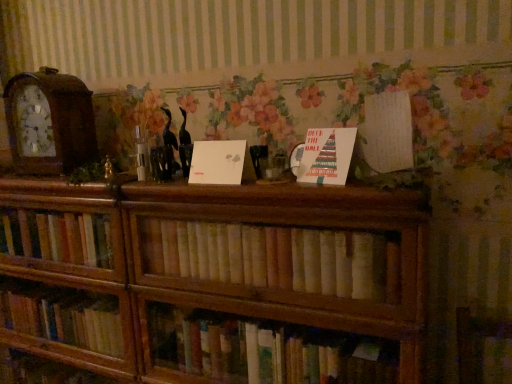
Question: Does light brown wooden bookshelf at center have a smaller size compared to white paper at upper right, the 1th paperback book when ordered from right to left?

Choices:
 (A) yes
 (B) no

Answer: (B)

Question: Is light brown wooden bookshelf at center at the left side of white paper at upper right, the third paperback book from the left?

Choices:
 (A) yes
 (B) no

Answer: (A)

Question: Is light brown wooden bookshelf at center oriented towards white paper at upper right, the third paperback book from the left?

Choices:
 (A) no
 (B) yes

Answer: (A)

Question: Does light brown wooden bookshelf at center have a larger size compared to white paper at upper right, the 1th paperback book when ordered from right to left?

Choices:
 (A) yes
 (B) no

Answer: (A)

Question: Is white paper at upper right, the 1th paperback book when ordered from right to left, inside light brown wooden bookshelf at center?

Choices:
 (A) no
 (B) yes

Answer: (A)

Question: Can you confirm if light brown wooden bookshelf at center is taller than white paper at upper right, the 1th paperback book when ordered from right to left?

Choices:
 (A) yes
 (B) no

Answer: (B)

Question: Is white paper at center, positioned as the first paperback book in left-to-right order, aimed at wooden clock at left?

Choices:
 (A) yes
 (B) no

Answer: (B)

Question: Is white paper at center, positioned as the first paperback book in left-to-right order, further to the viewer compared to wooden clock at left?

Choices:
 (A) yes
 (B) no

Answer: (B)

Question: Considering the relative sizes of white paper at center, positioned as the first paperback book in left-to-right order, and wooden clock at left in the image provided, is white paper at center, positioned as the first paperback book in left-to-right order, shorter than wooden clock at left?

Choices:
 (A) no
 (B) yes

Answer: (B)

Question: Can you confirm if white paper at center, positioned as the first paperback book in left-to-right order, is positioned to the left of wooden clock at left?

Choices:
 (A) yes
 (B) no

Answer: (B)

Question: Is white paper at center, the third paperback book when ordered from right to left, not close to wooden clock at left?

Choices:
 (A) no
 (B) yes

Answer: (A)

Question: Can you confirm if white paper at center, the third paperback book when ordered from right to left, is wider than wooden clock at left?

Choices:
 (A) no
 (B) yes

Answer: (A)

Question: Does white paper at center, which ranks as the 2th paperback book in left-to-right order, have a lesser width compared to wooden clock at left?

Choices:
 (A) no
 (B) yes

Answer: (B)